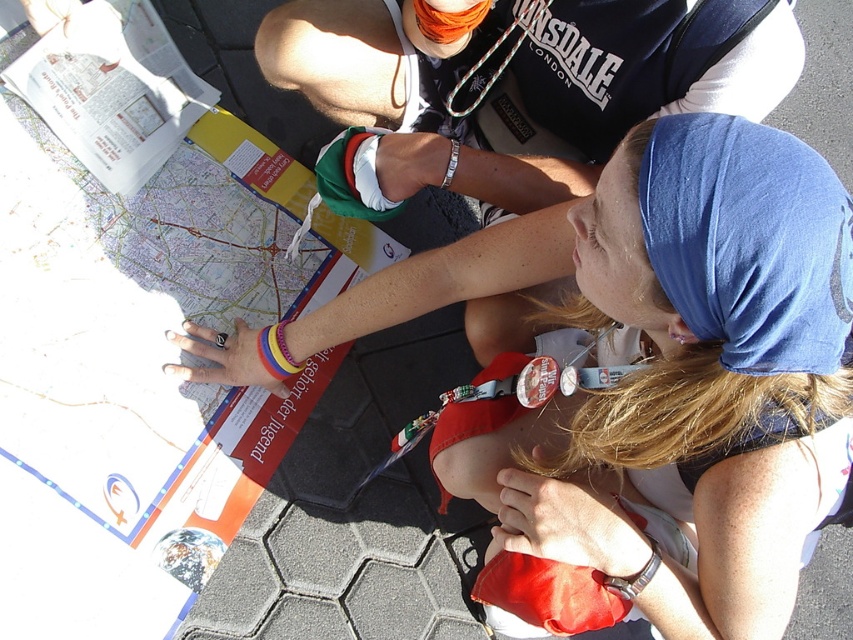
You are trying to determine the relative size of the white matte map at center and the dark blue fabric shirt at upper center. Based on the scene, which object is taller?

The white matte map at center is much taller than the dark blue fabric shirt at upper center.

You are a hiker trying to locate your position on the map. You see the white matte map at center and the dark blue fabric shirt at upper center. Which object is located to the right of the other?

The white matte map at center is positioned on the right side of dark blue fabric shirt at upper center.

You are trying to determine if the white matte map at center can be folded and placed inside the dark blue fabric shirt at upper center. Based on their sizes, what do you think?

The white matte map at center is larger in size than the dark blue fabric shirt at upper center, so it cannot be folded and placed inside.